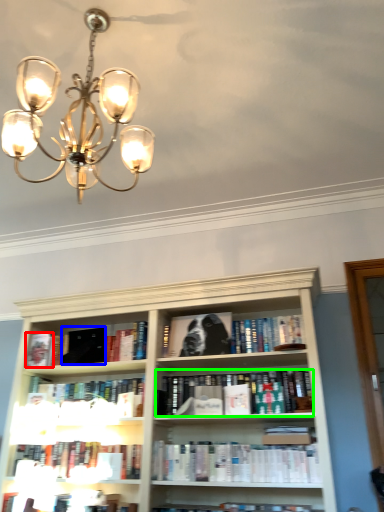
Question: Considering the real-world distances, which object is farthest from paperback book (highlighted by a red box)? paperback book (highlighted by a blue box) or book (highlighted by a green box)?

Choices:
 (A) paperback book
 (B) book

Answer: (B)